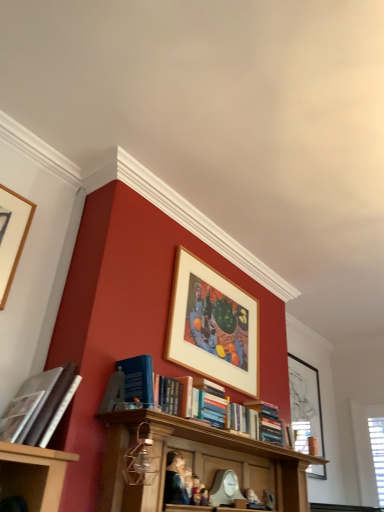
Question: Can you confirm if wooden picture frame at upper center, positioned as the second picture frame in right-to-left order, is shorter than hardcover book at left, marked as the 1th book in a left-to-right arrangement?

Choices:
 (A) yes
 (B) no

Answer: (B)

Question: Is wooden picture frame at upper center, placed as the second picture frame when sorted from bottom to top, oriented away from hardcover book at left, the 2th book viewed from the right?

Choices:
 (A) no
 (B) yes

Answer: (A)

Question: Can you confirm if wooden picture frame at upper center, which is the second picture frame from front to back, is thinner than hardcover book at left, marked as the 1th book in a left-to-right arrangement?

Choices:
 (A) no
 (B) yes

Answer: (B)

Question: Can hardcover book at left, marked as the 1th book in a left-to-right arrangement, be found inside wooden picture frame at upper center, placed as the second picture frame when sorted from bottom to top?

Choices:
 (A) yes
 (B) no

Answer: (B)

Question: From a real-world perspective, does wooden picture frame at upper center, positioned as the second picture frame in right-to-left order, sit lower than hardcover book at left, the 2th book ordered from the bottom?

Choices:
 (A) no
 (B) yes

Answer: (A)

Question: Is wooden picture frame at upper center, which is the second picture frame from left to right, with hardcover book at left, acting as the first book starting from the top?

Choices:
 (A) no
 (B) yes

Answer: (A)

Question: Could black matte picture frame at upper right, which appears as the third picture frame when viewed from the top, be considered to be inside wooden picture frame at upper left, placed as the third picture frame when sorted from back to front?

Choices:
 (A) yes
 (B) no

Answer: (B)

Question: From a real-world perspective, does wooden picture frame at upper left, the third picture frame in the bottom-to-top sequence, stand above black matte picture frame at upper right, positioned as the 3th picture frame in front-to-back order?

Choices:
 (A) no
 (B) yes

Answer: (B)

Question: Can you confirm if wooden picture frame at upper left, which is the 3th picture frame in right-to-left order, is wider than black matte picture frame at upper right, which appears as the first picture frame when ordered from the bottom?

Choices:
 (A) no
 (B) yes

Answer: (A)

Question: Is wooden picture frame at upper left, placed as the third picture frame when sorted from back to front, looking in the opposite direction of black matte picture frame at upper right, which ranks as the 1th picture frame in right-to-left order?

Choices:
 (A) no
 (B) yes

Answer: (A)

Question: Considering the relative sizes of wooden picture frame at upper left, the first picture frame in the left-to-right sequence, and black matte picture frame at upper right, which appears as the third picture frame when viewed from the top, in the image provided, is wooden picture frame at upper left, the first picture frame in the left-to-right sequence, taller than black matte picture frame at upper right, which appears as the third picture frame when viewed from the top,?

Choices:
 (A) no
 (B) yes

Answer: (A)

Question: From a real-world perspective, is wooden picture frame at upper left, the third picture frame in the bottom-to-top sequence, beneath black matte picture frame at upper right, which appears as the first picture frame when ordered from the bottom?

Choices:
 (A) no
 (B) yes

Answer: (A)

Question: Considering the relative sizes of black matte picture frame at upper right, which ranks as the 1th picture frame in right-to-left order, and smooth plastic figurine at center, which appears as the first person when viewed from the right, in the image provided, is black matte picture frame at upper right, which ranks as the 1th picture frame in right-to-left order, thinner than smooth plastic figurine at center, which appears as the first person when viewed from the right,?

Choices:
 (A) yes
 (B) no

Answer: (A)